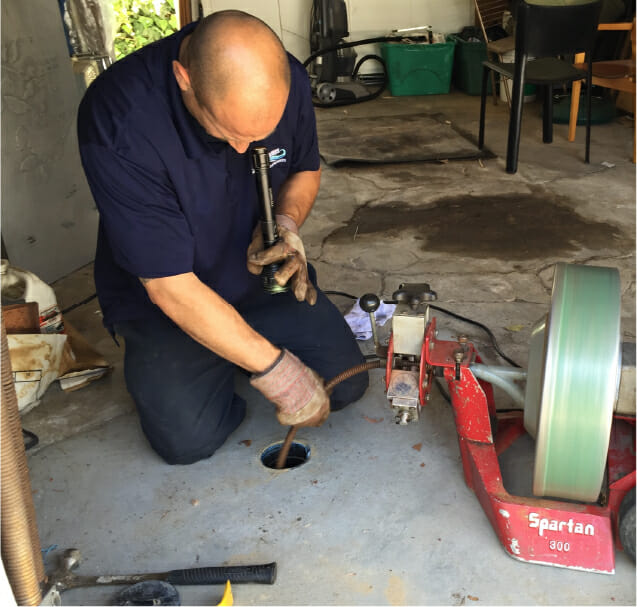
This screenshot has width=637, height=607. I want to click on chair, so click(555, 42).